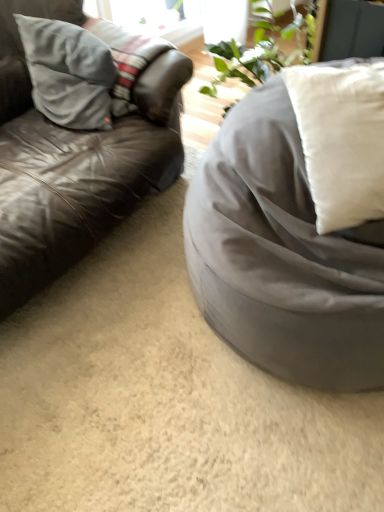
Question: Based on their sizes in the image, would you say suede gray pillow at left, the second pillow when ordered from front to back, is bigger or smaller than satin gray bean bag at right?

Choices:
 (A) big
 (B) small

Answer: (B)

Question: Do you think suede gray pillow at left, the 1th pillow positioned from the left, is within satin gray bean bag at right, or outside of it?

Choices:
 (A) outside
 (B) inside

Answer: (A)

Question: Which of these objects is positioned farthest from the leather couch at left?

Choices:
 (A) suede gray pillow at left, the second pillow when ordered from front to back
 (B) white soft cushion at right, arranged as the 1th pillow when viewed from the front
 (C) satin gray bean bag at right

Answer: (B)

Question: Considering the real-world distances, which object is farthest from the leather couch at left?

Choices:
 (A) satin gray bean bag at right
 (B) white soft cushion at right, which is the second pillow from left to right
 (C) suede gray pillow at left, the 2th pillow from the right

Answer: (B)